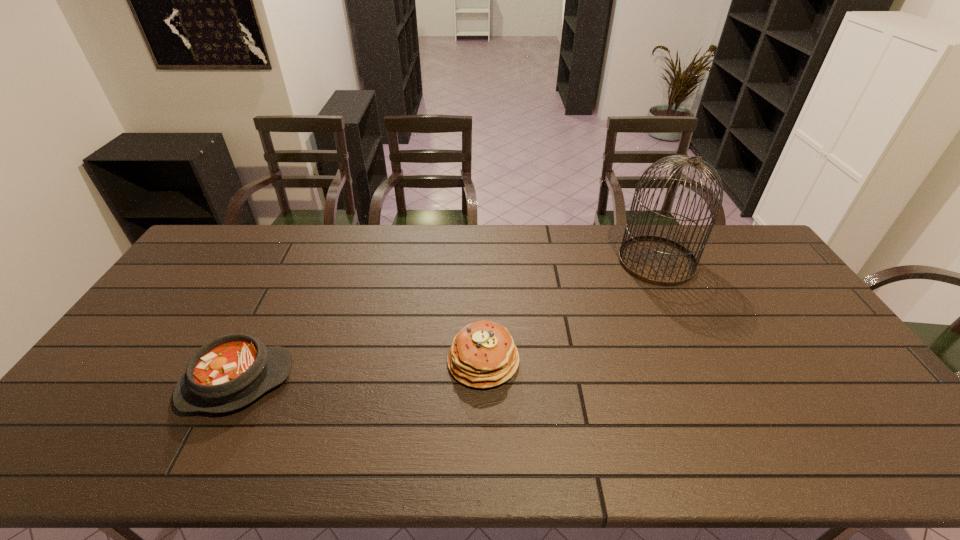
Identify the location of the rightmost object. This screenshot has width=960, height=540. (656, 260).

Identify the location of birdcage. This screenshot has height=540, width=960. (656, 260).

This screenshot has height=540, width=960. I want to click on the second object from right to left, so click(483, 355).

The width and height of the screenshot is (960, 540). Identify the location of the leftmost object. (227, 373).

You are a GUI agent. You are given a task and a screenshot of the screen. Output one action in this format:
    pyautogui.click(x=<x>, y=<y>)
    Task: Click on the free region located on the left of the birdcage
    This screenshot has width=960, height=540.
    Given the screenshot: What is the action you would take?
    (x=569, y=261)

The image size is (960, 540). What are the coordinates of `vacant space positioned on the right of the second object from left to right` in the screenshot? It's located at (625, 361).

Locate an element on the screen. This screenshot has width=960, height=540. vacant space positioned on the right of the casserole is located at coordinates (425, 382).

Where is `object at the far edge`? The image size is (960, 540). object at the far edge is located at coordinates (656, 260).

In order to click on free space at the far edge of the desktop in this screenshot , I will do `click(499, 260)`.

At what (x,y) coordinates should I click in order to perform the action: click on vacant space at the near edge. Please return your answer as a coordinate pair (x, y). The image size is (960, 540). Looking at the image, I should click on (736, 469).